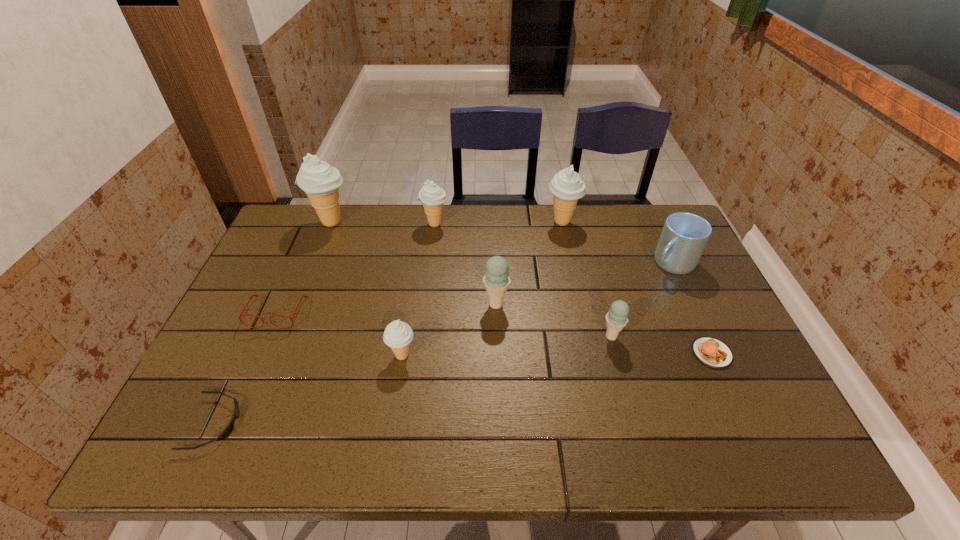
Image resolution: width=960 pixels, height=540 pixels. In order to click on vacant space positioned 0.200m on the left of the seventh nearest object in this screenshot , I will do `click(583, 263)`.

The width and height of the screenshot is (960, 540). I want to click on vacant position located on the right of the nearer blue ice cream, so click(x=726, y=336).

The width and height of the screenshot is (960, 540). What are the coordinates of `vacant space situated on the back of the nearest beige icecream` in the screenshot? It's located at (410, 303).

This screenshot has width=960, height=540. In order to click on vacant region located on the face of the spectacles in this screenshot , I will do `click(248, 377)`.

Locate an element on the screen. Image resolution: width=960 pixels, height=540 pixels. free space located 0.330m on the back of the ninth tallest object is located at coordinates (666, 254).

Where is `free location located on the front-facing side of the shortest object`? free location located on the front-facing side of the shortest object is located at coordinates (337, 423).

Locate an element on the screen. This screenshot has width=960, height=540. mug present at the far edge is located at coordinates (684, 236).

Find the location of a particular element. This screenshot has height=540, width=960. object that is at the near edge is located at coordinates (228, 430).

Image resolution: width=960 pixels, height=540 pixels. I want to click on icecream located at the left edge, so click(x=320, y=181).

This screenshot has height=540, width=960. In order to click on spectacles at the left edge in this screenshot , I will do `click(240, 315)`.